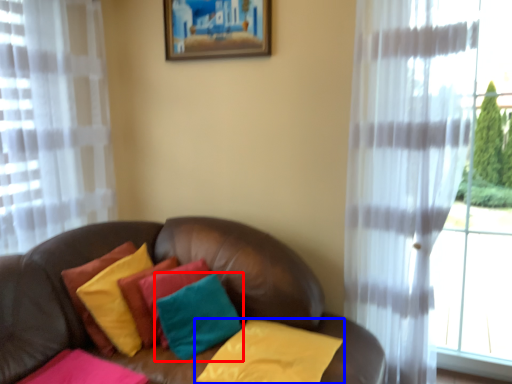
Question: Among these objects, which one is farthest to the camera, pillow (highlighted by a red box) or pillow (highlighted by a blue box)?

Choices:
 (A) pillow
 (B) pillow

Answer: (A)